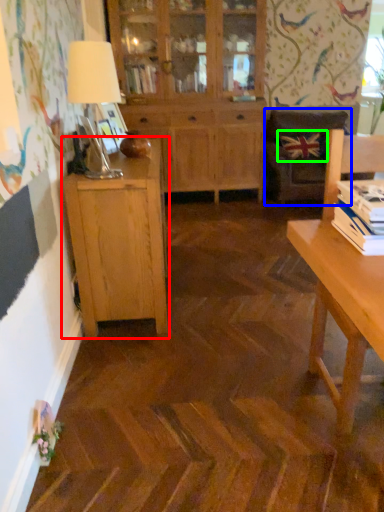
Question: Considering the real-world distances, which object is farthest from cabinetry (highlighted by a red box)? chair (highlighted by a blue box) or pillow (highlighted by a green box)?

Choices:
 (A) chair
 (B) pillow

Answer: (B)